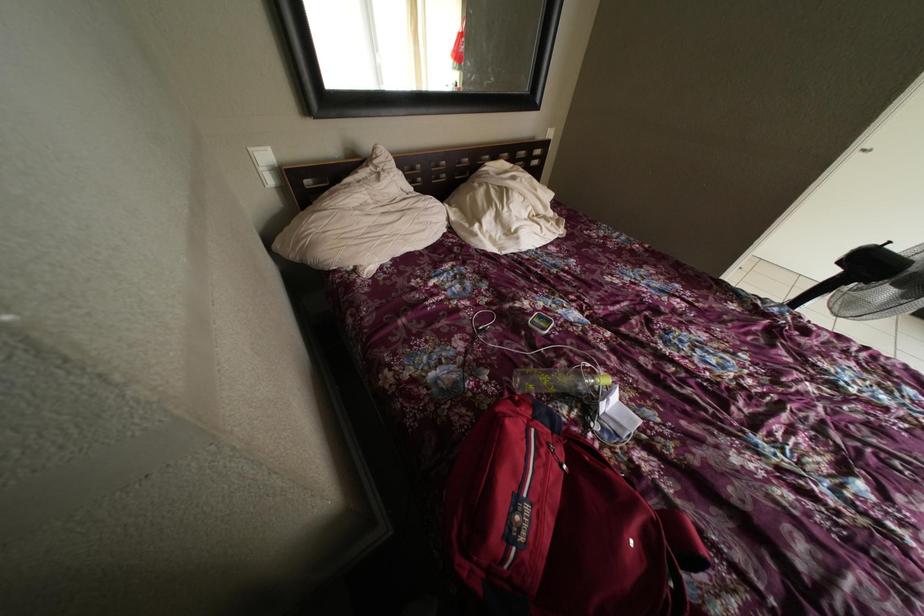
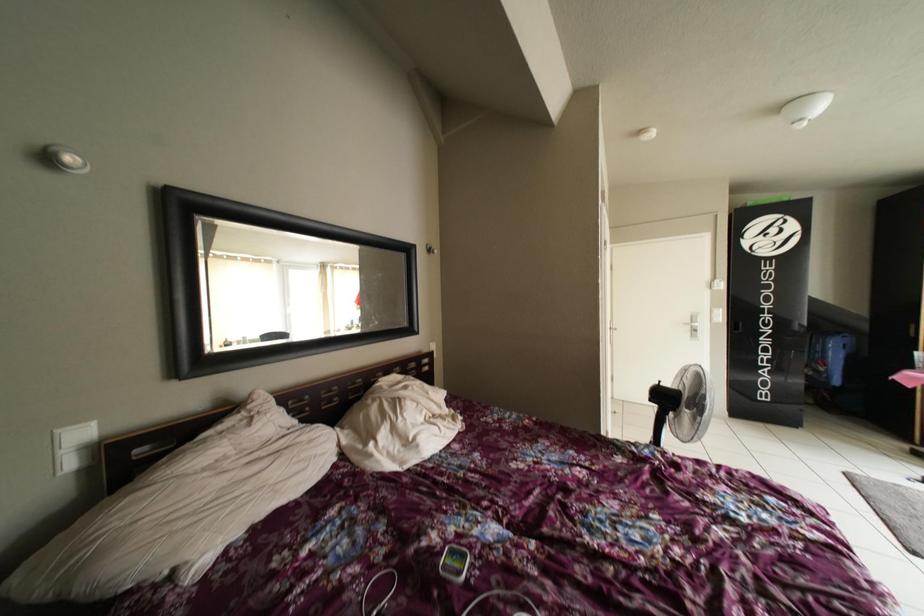
First-person continuous shooting, in which direction is the camera rotating?

The camera rotated toward right-up.